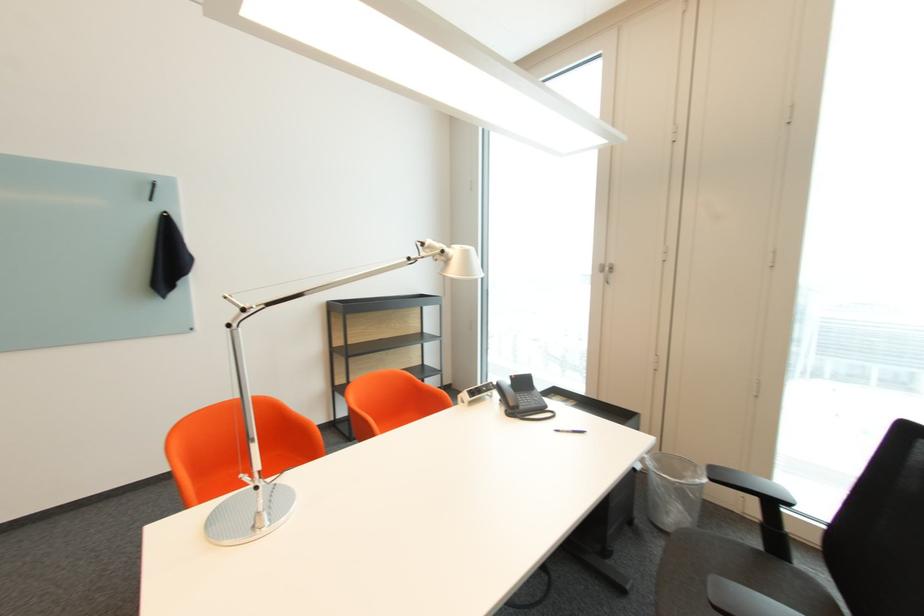
This screenshot has width=924, height=616. I want to click on black telephone handset, so click(x=506, y=394).